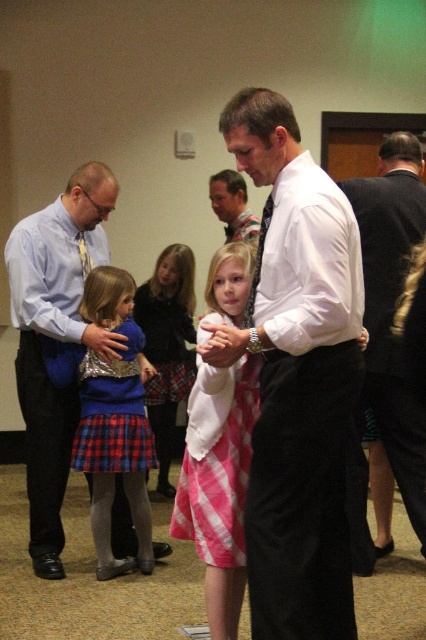
You are organizing a clothing display and need to place the plaid skirt at left and the brushed metal tie at left on a rack. Which item should you place first if you want to arrange them from largest to smallest?

The plaid skirt at left is bigger than the brushed metal tie at left, so you should place the plaid skirt at left first when arranging from largest to smallest.

In the scene, you notice two items made of plaid fabric. The first is the plaid skirt at left, and the second is the plaid fabric dress at center. Which of these two plaid items is positioned lower in the image?

The plaid skirt at left is positioned lower in the image because it is described as being below the plaid fabric dress at center.